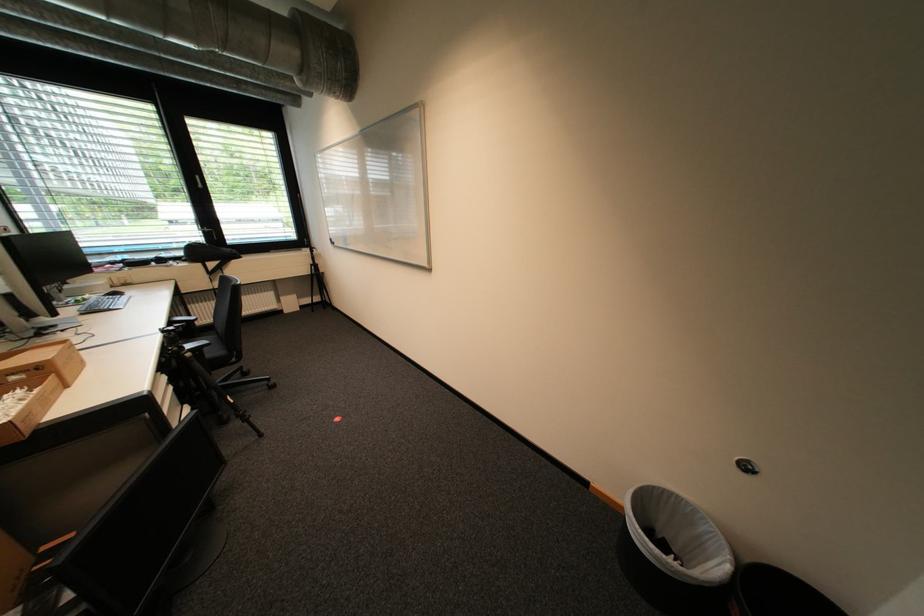
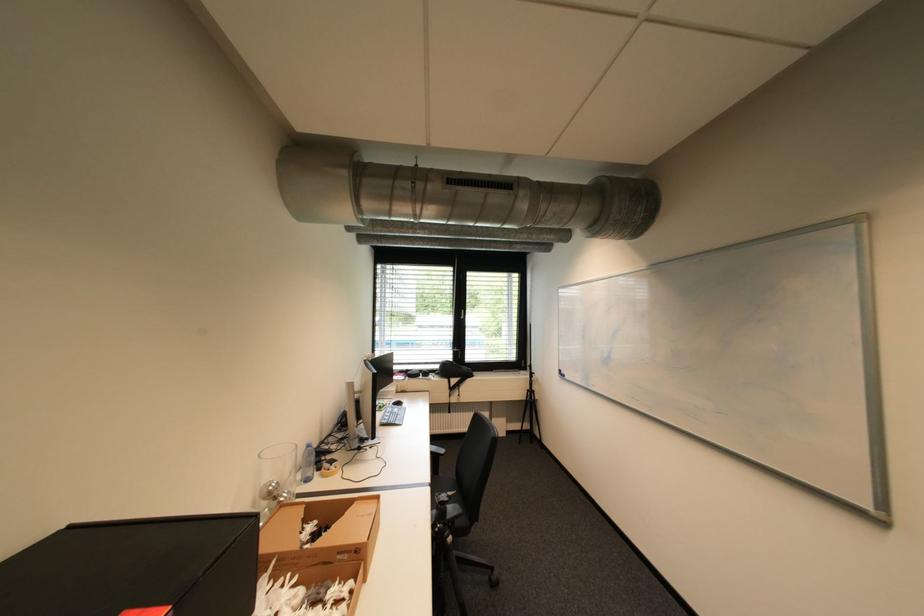
Find the pixel in the second image that matches pixel 197 355 in the first image.

(458, 540)